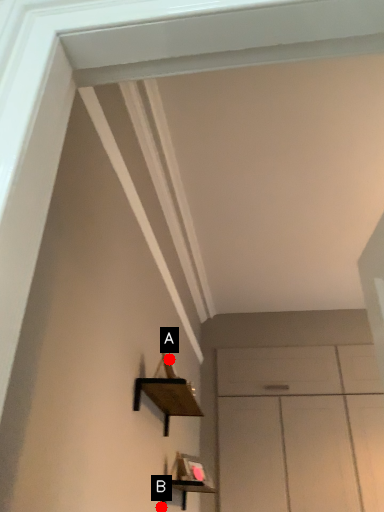
Question: Two points are circled on the image, labeled by A and B beside each circle. Which point is closer to the camera taking this photo?

Choices:
 (A) A is closer
 (B) B is closer

Answer: (B)